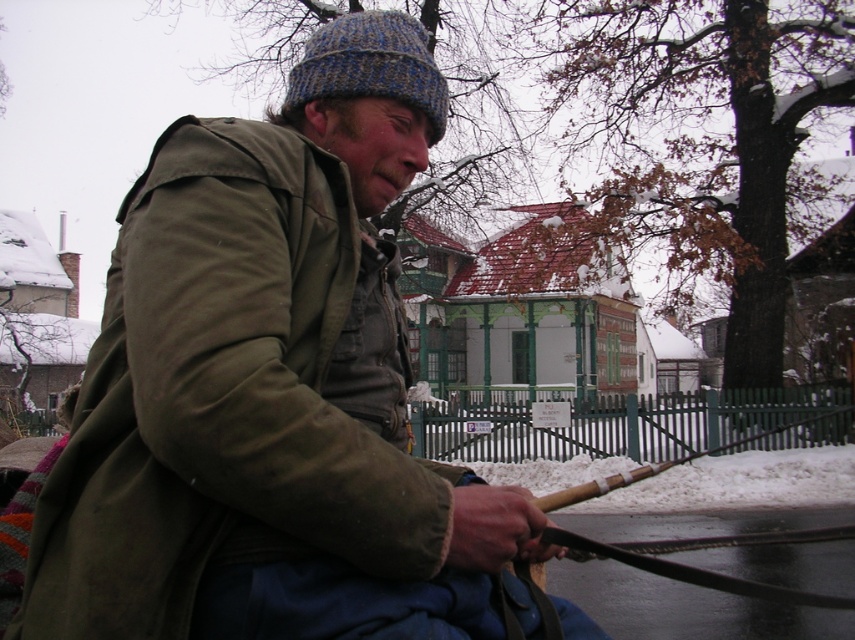
You are a fashion designer observing the man in the winter scene. You need to determine the spatial relationship between his olive green canvas jacket at center and his knitted woolen hat at upper center. Which object is located to the left of the other?

The olive green canvas jacket at center is positioned on the left side of knitted woolen hat at upper center, so the jacket is to the left of the hat.